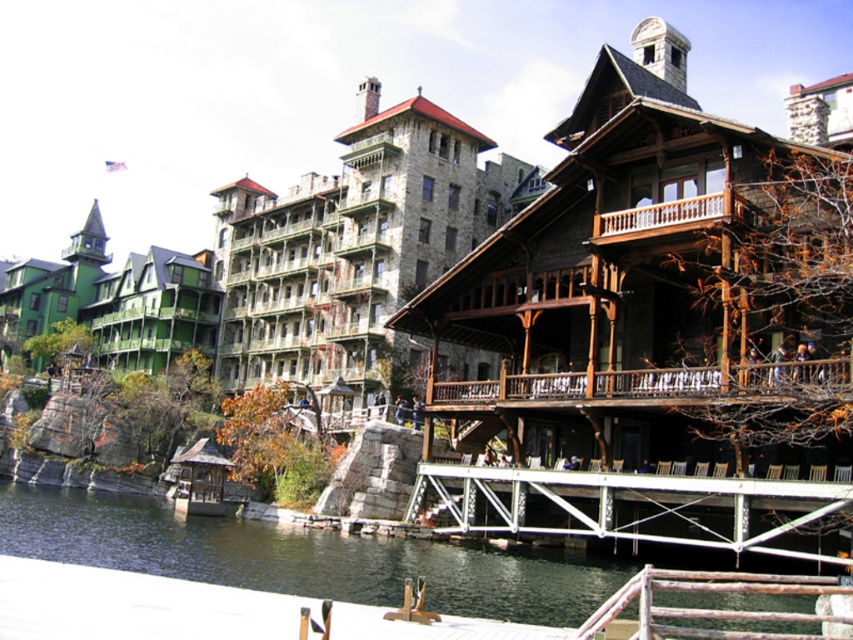
Question: Is white metal dock at lower center thinner than brown wooden railing at center?

Choices:
 (A) no
 (B) yes

Answer: (A)

Question: Based on their relative distances, which object is farther from the brown wooden railing at center?

Choices:
 (A) white metal dock at lower center
 (B) dark green water at lower left

Answer: (B)

Question: Considering the real-world distances, which object is closest to the dark green water at lower left?

Choices:
 (A) brown wooden railing at center
 (B) white metal dock at lower center

Answer: (B)

Question: Based on their relative distances, which object is farther from the brown wooden railing at center?

Choices:
 (A) dark green water at lower left
 (B) white metal dock at lower center

Answer: (A)

Question: Is white metal dock at lower center above brown wooden railing at center?

Choices:
 (A) yes
 (B) no

Answer: (B)

Question: Does white metal dock at lower center have a smaller size compared to brown wooden railing at center?

Choices:
 (A) yes
 (B) no

Answer: (B)